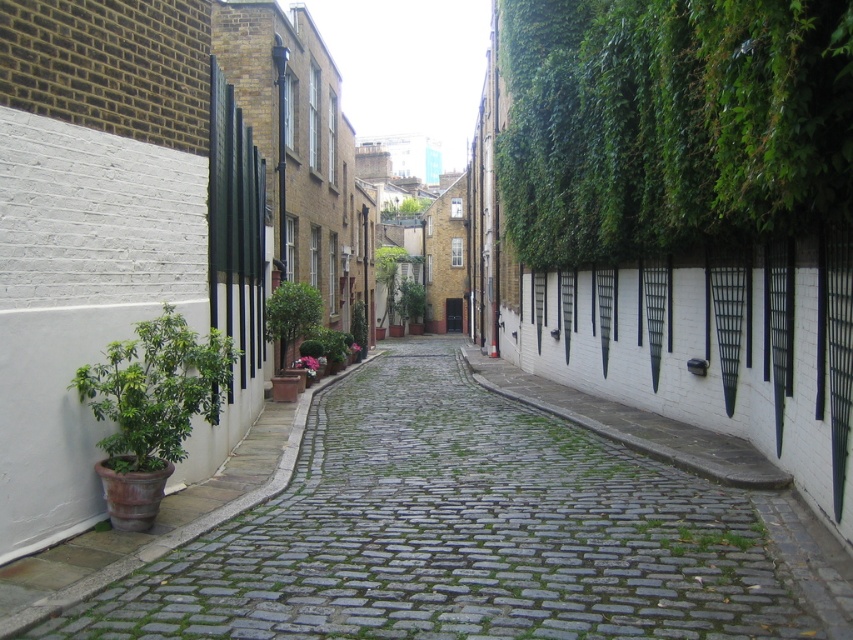
Question: Does green grass at center have a smaller size compared to green leafy plant at center?

Choices:
 (A) yes
 (B) no

Answer: (A)

Question: Is green leafy plant at left below green leafy plant at center?

Choices:
 (A) no
 (B) yes

Answer: (B)

Question: Is green leafy plant at left behind green leafy plant at center?

Choices:
 (A) yes
 (B) no

Answer: (B)

Question: Among these objects, which one is nearest to the camera?

Choices:
 (A) green leafy ivy at right
 (B) green mossy cobblestone alley at lower left
 (C) green leafy plant at center
 (D) green leafy plant at left

Answer: (A)

Question: Which of the following is the closest to the observer?

Choices:
 (A) green mossy cobblestone alley at lower left
 (B) green leafy plant at left
 (C) green grass at center

Answer: (A)

Question: Which object appears closest to the camera in this image?

Choices:
 (A) green grass at center
 (B) green mossy cobblestone alley at lower left
 (C) green leafy plant at left
 (D) green leafy ivy at right

Answer: (D)